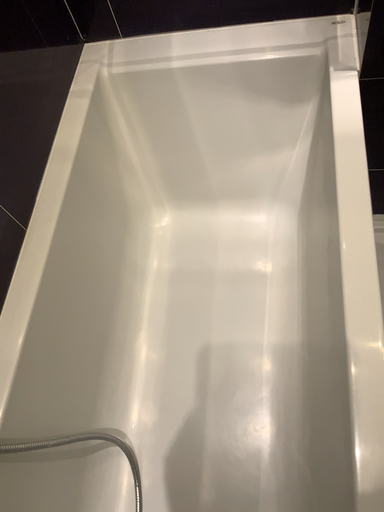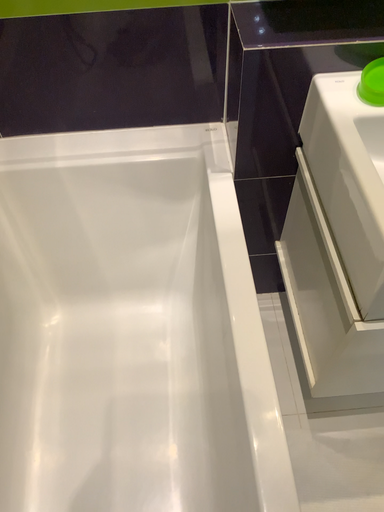
Question: How did the camera likely rotate when shooting the video?

Choices:
 (A) rotated right
 (B) rotated left

Answer: (A)